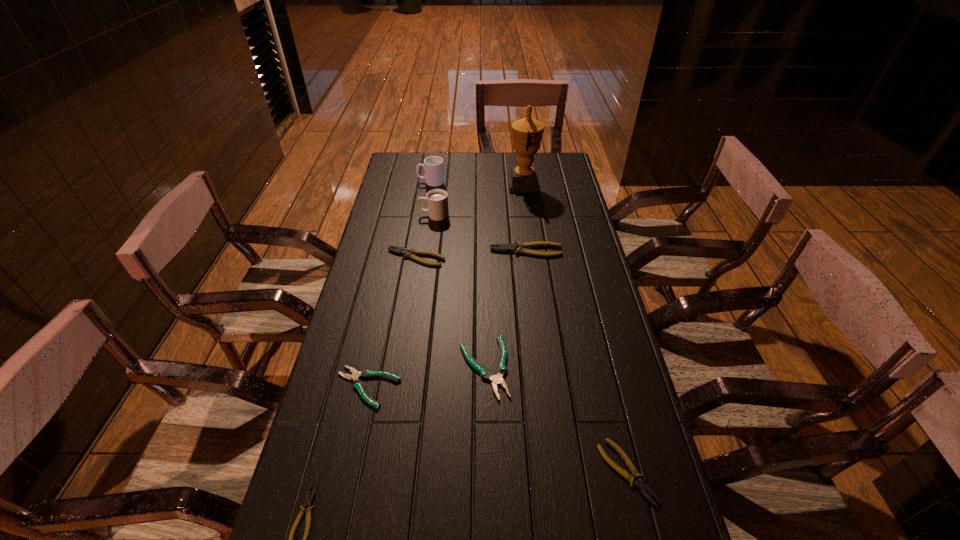
Point out which object is positioned as the fifth nearest to the third biggest yellow pliers. Please provide its 2D coordinates. Your answer should be formatted as a tuple, i.e. [(x, y)], where the tuple contains the x and y coordinates of a point satisfying the conditions above.

[(410, 252)]

Identify which pliers is located as the nearest to the left teal pliers. Please provide its 2D coordinates. Your answer should be formatted as a tuple, i.e. [(x, y)], where the tuple contains the x and y coordinates of a point satisfying the conditions above.

[(496, 379)]

You are a GUI agent. You are given a task and a screenshot of the screen. Output one action in this format:
    pyautogui.click(x=<x>, y=<y>)
    Task: Click on the closest pliers relative to the cup
    
    Given the screenshot: What is the action you would take?
    pyautogui.click(x=410, y=252)

Identify which yellow pliers is located as the second nearest to the smallest yellow pliers. Please provide its 2D coordinates. Your answer should be formatted as a tuple, i.e. [(x, y)], where the tuple contains the x and y coordinates of a point satisfying the conditions above.

[(410, 252)]

Locate an element on the screen. This screenshot has height=540, width=960. yellow pliers that is the second nearest to the tallest pliers is located at coordinates (639, 483).

Find the location of a particular element. This screenshot has width=960, height=540. teal pliers that is the second closest one to the tallest pliers is located at coordinates (357, 384).

The image size is (960, 540). I want to click on teal pliers that is the closest to the cup, so click(x=496, y=379).

The width and height of the screenshot is (960, 540). I want to click on free region that satisfies the following two spatial constraints: 1. on the side with the handle of the cappuccino; 2. on the left side of the sixth shortest object, so (429, 251).

This screenshot has width=960, height=540. In order to click on blank space that satisfies the following two spatial constraints: 1. on the side with the handle of the third farthest object; 2. on the left side of the bigger teal pliers in this screenshot , I will do `click(414, 367)`.

Where is `vacant space that satisfies the following two spatial constraints: 1. on the back side of the tallest pliers; 2. on the side with the handle of the cappuccino`? The height and width of the screenshot is (540, 960). vacant space that satisfies the following two spatial constraints: 1. on the back side of the tallest pliers; 2. on the side with the handle of the cappuccino is located at coordinates (521, 215).